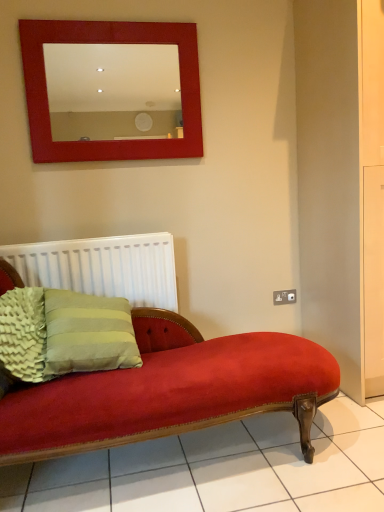
Question: Is white plastic radiator at lower left facing away from satin silver outlet at lower right?

Choices:
 (A) yes
 (B) no

Answer: (B)

Question: Is white plastic radiator at lower left at the right side of satin silver outlet at lower right?

Choices:
 (A) yes
 (B) no

Answer: (B)

Question: Considering the relative sizes of white plastic radiator at lower left and satin silver outlet at lower right in the image provided, is white plastic radiator at lower left thinner than satin silver outlet at lower right?

Choices:
 (A) no
 (B) yes

Answer: (A)

Question: Could you tell me if white plastic radiator at lower left is turned towards satin silver outlet at lower right?

Choices:
 (A) yes
 (B) no

Answer: (B)

Question: Is white plastic radiator at lower left touching satin silver outlet at lower right?

Choices:
 (A) no
 (B) yes

Answer: (A)

Question: From a real-world perspective, is white plastic radiator at lower left physically above satin silver outlet at lower right?

Choices:
 (A) yes
 (B) no

Answer: (A)

Question: Is green textured pillow at lower left located outside satin silver outlet at lower right?

Choices:
 (A) no
 (B) yes

Answer: (B)

Question: Is green textured pillow at lower left positioned behind satin silver outlet at lower right?

Choices:
 (A) yes
 (B) no

Answer: (B)

Question: From the image's perspective, would you say green textured pillow at lower left is shown under satin silver outlet at lower right?

Choices:
 (A) no
 (B) yes

Answer: (B)

Question: Does green textured pillow at lower left have a lesser width compared to satin silver outlet at lower right?

Choices:
 (A) yes
 (B) no

Answer: (B)

Question: Is green textured pillow at lower left looking in the opposite direction of satin silver outlet at lower right?

Choices:
 (A) yes
 (B) no

Answer: (B)

Question: Can you confirm if green textured pillow at lower left is bigger than satin silver outlet at lower right?

Choices:
 (A) no
 (B) yes

Answer: (B)

Question: Would you say satin silver outlet at lower right contains white plastic radiator at lower left?

Choices:
 (A) no
 (B) yes

Answer: (A)